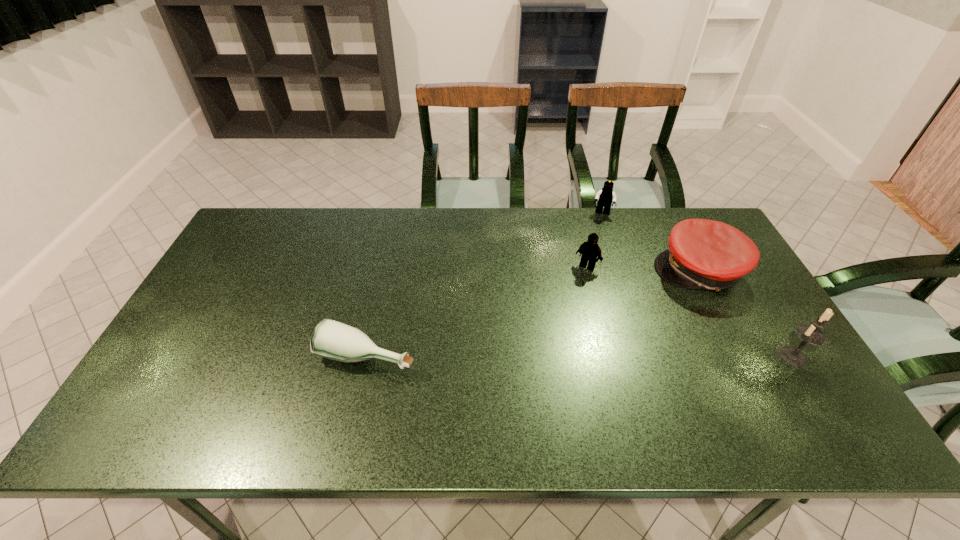
Where is `Lego situated at the far edge`? The width and height of the screenshot is (960, 540). Lego situated at the far edge is located at coordinates pos(605,197).

Where is `object that is at the near edge`? object that is at the near edge is located at coordinates (333, 340).

The width and height of the screenshot is (960, 540). I want to click on candle holder that is at the right edge, so click(x=811, y=334).

Locate an element on the screen. The width and height of the screenshot is (960, 540). cap positioned at the right edge is located at coordinates (703, 254).

Find the location of a particular element. The height and width of the screenshot is (540, 960). object located at the far right corner is located at coordinates [703, 254].

Where is `blank space at the far edge of the desktop`? blank space at the far edge of the desktop is located at coordinates (554, 237).

This screenshot has width=960, height=540. What are the coordinates of `free region at the near edge` in the screenshot? It's located at (549, 397).

In the image, there is a desktop. Identify the location of free region at the left edge. (242, 274).

This screenshot has width=960, height=540. I want to click on blank space at the right edge, so click(756, 360).

The width and height of the screenshot is (960, 540). In the image, there is a desktop. Find the location of `free space at the far left corner`. free space at the far left corner is located at coordinates (247, 245).